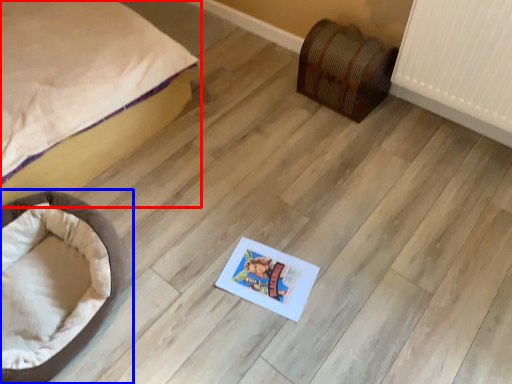
Question: Among these objects, which one is farthest to the camera, bed (highlighted by a red box) or dog bed (highlighted by a blue box)?

Choices:
 (A) bed
 (B) dog bed

Answer: (B)